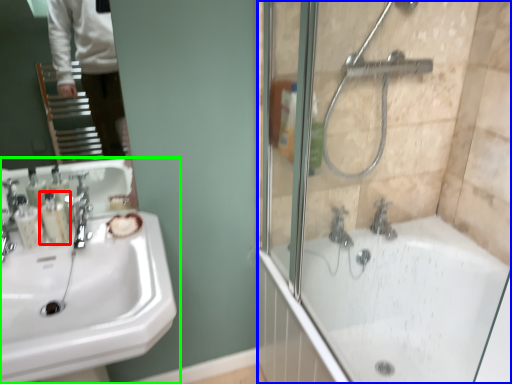
Question: Estimate the real-world distances between objects in this image. Which object is farther from toiletry (highlighted by a red box), screen door (highlighted by a blue box) or sink (highlighted by a green box)?

Choices:
 (A) screen door
 (B) sink

Answer: (A)